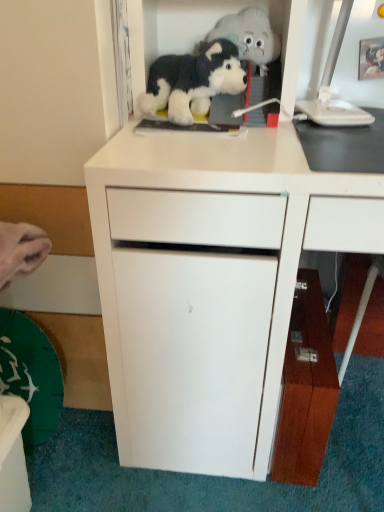
Describe the element at coordinates (305, 390) in the screenshot. I see `wooden cabinet at lower right, arranged as the 1th cabinetry when viewed from the right` at that location.

What is the approximate height of white plastic computer monitor at upper right?

white plastic computer monitor at upper right is 8.84 inches tall.

What do you see at coordinates (193, 81) in the screenshot? This screenshot has height=512, width=384. I see `black plush dog at upper center, placed as the 1th toy when sorted from bottom to top` at bounding box center [193, 81].

This screenshot has height=512, width=384. What do you see at coordinates (254, 49) in the screenshot? I see `fluffy plush toy at upper center, marked as the 1th toy in a top-to-bottom arrangement` at bounding box center [254, 49].

Find the location of a particular element. wooden cabinet at lower right, arranged as the 1th cabinetry when viewed from the right is located at coordinates (305, 390).

From the picture: From a real-world perspective, between white plastic computer monitor at upper right and fluffy plush toy at upper center, acting as the 2th toy starting from the bottom, who is vertically higher?

fluffy plush toy at upper center, acting as the 2th toy starting from the bottom.

Between white plastic computer monitor at upper right and fluffy plush toy at upper center, marked as the 1th toy in a top-to-bottom arrangement, which one appears on the left side from the viewer's perspective?

fluffy plush toy at upper center, marked as the 1th toy in a top-to-bottom arrangement.

From the image's perspective, which is above, white plastic computer monitor at upper right or fluffy plush toy at upper center, acting as the 2th toy starting from the bottom?

fluffy plush toy at upper center, acting as the 2th toy starting from the bottom.

In the image, there is a fluffy plush toy at upper center, acting as the 2th toy starting from the bottom. At what (x,y) coordinates should I click in order to perform the action: click on computer monitor below it (from a real-world perspective). Please return your answer as a coordinate pair (x, y). The image size is (384, 512). Looking at the image, I should click on (330, 86).

In the scene shown: Between white matte cabinet at center, the first cabinetry when ordered from left to right, and white plastic computer monitor at upper right, which one has larger width?

white matte cabinet at center, the first cabinetry when ordered from left to right, is wider.

Are white matte cabinet at center, the first cabinetry when ordered from left to right, and white plastic computer monitor at upper right beside each other?

There is a gap between white matte cabinet at center, the first cabinetry when ordered from left to right, and white plastic computer monitor at upper right.

Measure the distance from white matte cabinet at center, the first cabinetry when ordered from left to right, to white plastic computer monitor at upper right.

white matte cabinet at center, the first cabinetry when ordered from left to right, and white plastic computer monitor at upper right are 15.96 inches apart.

Considering the sizes of objects black plush dog at upper center, placed as the 1th toy when sorted from bottom to top, and white matte cabinet at center, which is the 2th cabinetry from right to left, in the image provided, who is smaller, black plush dog at upper center, placed as the 1th toy when sorted from bottom to top, or white matte cabinet at center, which is the 2th cabinetry from right to left,?

Smaller between the two is black plush dog at upper center, placed as the 1th toy when sorted from bottom to top.

Is black plush dog at upper center, the second toy positioned from the top, not inside white matte cabinet at center, which is the 2th cabinetry from right to left?

No, black plush dog at upper center, the second toy positioned from the top, is inside or overlapping with white matte cabinet at center, which is the 2th cabinetry from right to left.

From the image's perspective, is black plush dog at upper center, placed as the 1th toy when sorted from bottom to top, on top of white matte cabinet at center, the first cabinetry when ordered from left to right?

Yes, from the image's perspective, black plush dog at upper center, placed as the 1th toy when sorted from bottom to top, is on top of white matte cabinet at center, the first cabinetry when ordered from left to right.

Can we say fluffy plush toy at upper center, acting as the 2th toy starting from the bottom, lies outside white plastic computer monitor at upper right?

Yes, fluffy plush toy at upper center, acting as the 2th toy starting from the bottom, is not within white plastic computer monitor at upper right.

Considering their positions, is fluffy plush toy at upper center, marked as the 1th toy in a top-to-bottom arrangement, located in front of or behind white plastic computer monitor at upper right?

Visually, fluffy plush toy at upper center, marked as the 1th toy in a top-to-bottom arrangement, is located behind white plastic computer monitor at upper right.

Consider the image. Is fluffy plush toy at upper center, acting as the 2th toy starting from the bottom, not near white plastic computer monitor at upper right?

No, there isn't a large distance between fluffy plush toy at upper center, acting as the 2th toy starting from the bottom, and white plastic computer monitor at upper right.

How different are the orientations of fluffy plush toy at upper center, marked as the 1th toy in a top-to-bottom arrangement, and white plastic computer monitor at upper right in degrees?

The facing directions of fluffy plush toy at upper center, marked as the 1th toy in a top-to-bottom arrangement, and white plastic computer monitor at upper right are 12.7 degrees apart.

From a real-world perspective, is white matte cabinet at center, the first cabinetry when ordered from left to right, physically located above or below black plush dog at upper center, placed as the 1th toy when sorted from bottom to top?

white matte cabinet at center, the first cabinetry when ordered from left to right, is below black plush dog at upper center, placed as the 1th toy when sorted from bottom to top.

Locate an element on the screen. This screenshot has height=512, width=384. cabinetry in front of the black plush dog at upper center, the second toy positioned from the top is located at coordinates (216, 278).

Looking at this image, from the image's perspective, between white matte cabinet at center, the first cabinetry when ordered from left to right, and black plush dog at upper center, the second toy positioned from the top, who is located below?

white matte cabinet at center, the first cabinetry when ordered from left to right.

Does white matte cabinet at center, the first cabinetry when ordered from left to right, have a lesser height compared to black plush dog at upper center, the second toy positioned from the top?

Incorrect, the height of white matte cabinet at center, the first cabinetry when ordered from left to right, does not fall short of that of black plush dog at upper center, the second toy positioned from the top.

Does black plush dog at upper center, the second toy positioned from the top, have a greater height compared to white plastic computer monitor at upper right?

No, black plush dog at upper center, the second toy positioned from the top, is not taller than white plastic computer monitor at upper right.

From a real-world perspective, between black plush dog at upper center, the second toy positioned from the top, and white plastic computer monitor at upper right, who is vertically higher?

A: white plastic computer monitor at upper right.

In the image, is black plush dog at upper center, placed as the 1th toy when sorted from bottom to top, positioned in front of or behind white plastic computer monitor at upper right?

black plush dog at upper center, placed as the 1th toy when sorted from bottom to top, is behind white plastic computer monitor at upper right.

Considering the positions of points (189, 71) and (322, 113), is point (189, 71) closer to camera compared to point (322, 113)?

Yes, point (189, 71) is in front of point (322, 113).

Between fluffy plush toy at upper center, acting as the 2th toy starting from the bottom, and wooden cabinet at lower right, the second cabinetry viewed from the left, which one has larger width?

Wider between the two is wooden cabinet at lower right, the second cabinetry viewed from the left.

From the image's perspective, is fluffy plush toy at upper center, acting as the 2th toy starting from the bottom, located beneath wooden cabinet at lower right, the second cabinetry viewed from the left?

Incorrect, from the image's perspective, fluffy plush toy at upper center, acting as the 2th toy starting from the bottom, is higher than wooden cabinet at lower right, the second cabinetry viewed from the left.

From a real-world perspective, is fluffy plush toy at upper center, marked as the 1th toy in a top-to-bottom arrangement, physically located above or below wooden cabinet at lower right, the second cabinetry viewed from the left?

fluffy plush toy at upper center, marked as the 1th toy in a top-to-bottom arrangement, is situated higher than wooden cabinet at lower right, the second cabinetry viewed from the left, in the real world.

Considering the sizes of objects fluffy plush toy at upper center, acting as the 2th toy starting from the bottom, and wooden cabinet at lower right, the second cabinetry viewed from the left, in the image provided, who is bigger, fluffy plush toy at upper center, acting as the 2th toy starting from the bottom, or wooden cabinet at lower right, the second cabinetry viewed from the left,?

wooden cabinet at lower right, the second cabinetry viewed from the left.

Where is `toy that is above the white plastic computer monitor at upper right (from a real-world perspective)`? Image resolution: width=384 pixels, height=512 pixels. toy that is above the white plastic computer monitor at upper right (from a real-world perspective) is located at coordinates (254, 49).

In order to click on cabinetry in front of the white plastic computer monitor at upper right in this screenshot , I will do `click(216, 278)`.

When comparing their distances from black plush dog at upper center, the second toy positioned from the top, does white plastic computer monitor at upper right or wooden cabinet at lower right, the second cabinetry viewed from the left, seem closer?

white plastic computer monitor at upper right is positioned closer to the anchor black plush dog at upper center, the second toy positioned from the top.

From the image, which object appears to be nearer to fluffy plush toy at upper center, acting as the 2th toy starting from the bottom, black plush dog at upper center, the second toy positioned from the top, or white plastic computer monitor at upper right?

black plush dog at upper center, the second toy positioned from the top.

Looking at the image, which one is located further to white plastic computer monitor at upper right, wooden cabinet at lower right, arranged as the 1th cabinetry when viewed from the right, or fluffy plush toy at upper center, acting as the 2th toy starting from the bottom?

Among the two, wooden cabinet at lower right, arranged as the 1th cabinetry when viewed from the right, is located further to white plastic computer monitor at upper right.

From the image, which object appears to be nearer to black plush dog at upper center, the second toy positioned from the top, white plastic computer monitor at upper right or fluffy plush toy at upper center, acting as the 2th toy starting from the bottom?

Based on the image, fluffy plush toy at upper center, acting as the 2th toy starting from the bottom, appears to be nearer to black plush dog at upper center, the second toy positioned from the top.

Which object lies further to the anchor point fluffy plush toy at upper center, acting as the 2th toy starting from the bottom, white plastic computer monitor at upper right or wooden cabinet at lower right, arranged as the 1th cabinetry when viewed from the right?

wooden cabinet at lower right, arranged as the 1th cabinetry when viewed from the right, is further to fluffy plush toy at upper center, acting as the 2th toy starting from the bottom.

Which object lies further to the anchor point white plastic computer monitor at upper right, fluffy plush toy at upper center, acting as the 2th toy starting from the bottom, or white matte cabinet at center, which is the 2th cabinetry from right to left?

The object further to white plastic computer monitor at upper right is white matte cabinet at center, which is the 2th cabinetry from right to left.

Which object lies further to the anchor point fluffy plush toy at upper center, marked as the 1th toy in a top-to-bottom arrangement, black plush dog at upper center, the second toy positioned from the top, or wooden cabinet at lower right, arranged as the 1th cabinetry when viewed from the right?

wooden cabinet at lower right, arranged as the 1th cabinetry when viewed from the right, lies further to fluffy plush toy at upper center, marked as the 1th toy in a top-to-bottom arrangement, than the other object.

Based on their spatial positions, is white matte cabinet at center, the first cabinetry when ordered from left to right, or wooden cabinet at lower right, the second cabinetry viewed from the left, closer to black plush dog at upper center, the second toy positioned from the top?

white matte cabinet at center, the first cabinetry when ordered from left to right, is closer to black plush dog at upper center, the second toy positioned from the top.

Identify the location of cabinetry between white plastic computer monitor at upper right and wooden cabinet at lower right, the second cabinetry viewed from the left, vertically. (216, 278).

Where is `toy between fluffy plush toy at upper center, acting as the 2th toy starting from the bottom, and wooden cabinet at lower right, the second cabinetry viewed from the left, vertically`? Image resolution: width=384 pixels, height=512 pixels. toy between fluffy plush toy at upper center, acting as the 2th toy starting from the bottom, and wooden cabinet at lower right, the second cabinetry viewed from the left, vertically is located at coordinates (193, 81).

The width and height of the screenshot is (384, 512). In order to click on computer monitor that lies between fluffy plush toy at upper center, acting as the 2th toy starting from the bottom, and white matte cabinet at center, which is the 2th cabinetry from right to left, from top to bottom in this screenshot , I will do `click(330, 86)`.

I want to click on cabinetry between black plush dog at upper center, placed as the 1th toy when sorted from bottom to top, and wooden cabinet at lower right, the second cabinetry viewed from the left, vertically, so click(216, 278).